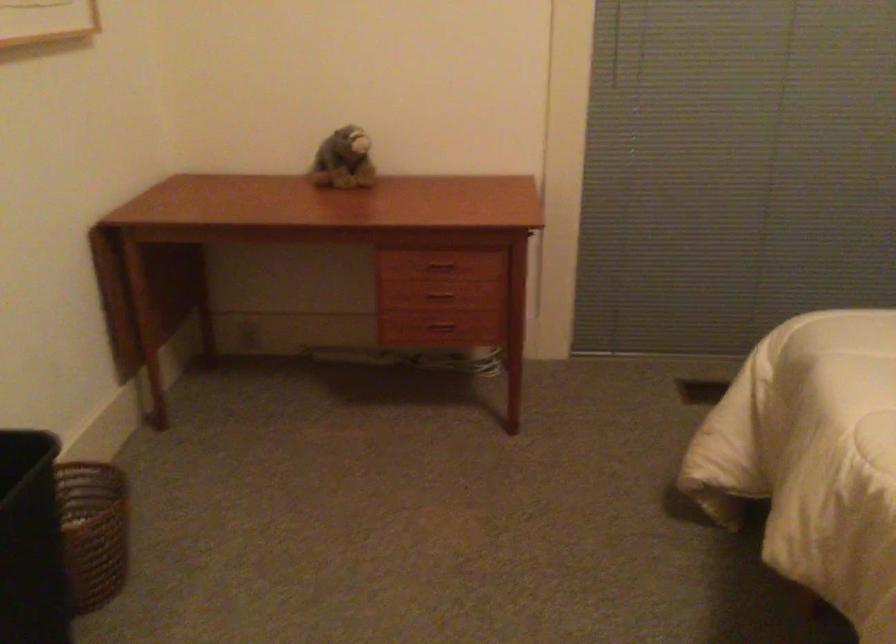
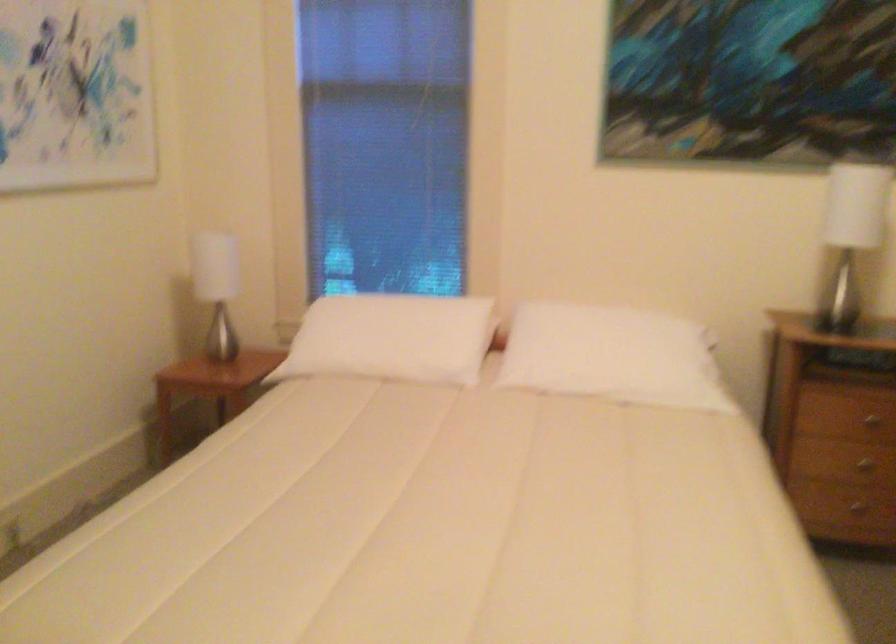
Question: The camera is either moving clockwise (left) or counter-clockwise (right) around the object. The first image is from the beginning of the video and the second image is from the end. Is the camera moving left or right when shooting the video?

Choices:
 (A) Left
 (B) Right

Answer: (A)